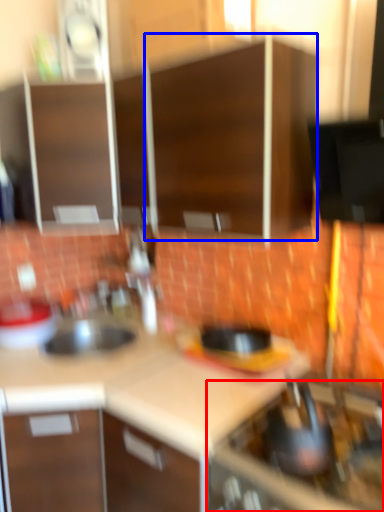
Question: Which object is closer to the camera taking this photo, home appliance (highlighted by a red box) or cabinetry (highlighted by a blue box)?

Choices:
 (A) home appliance
 (B) cabinetry

Answer: (A)